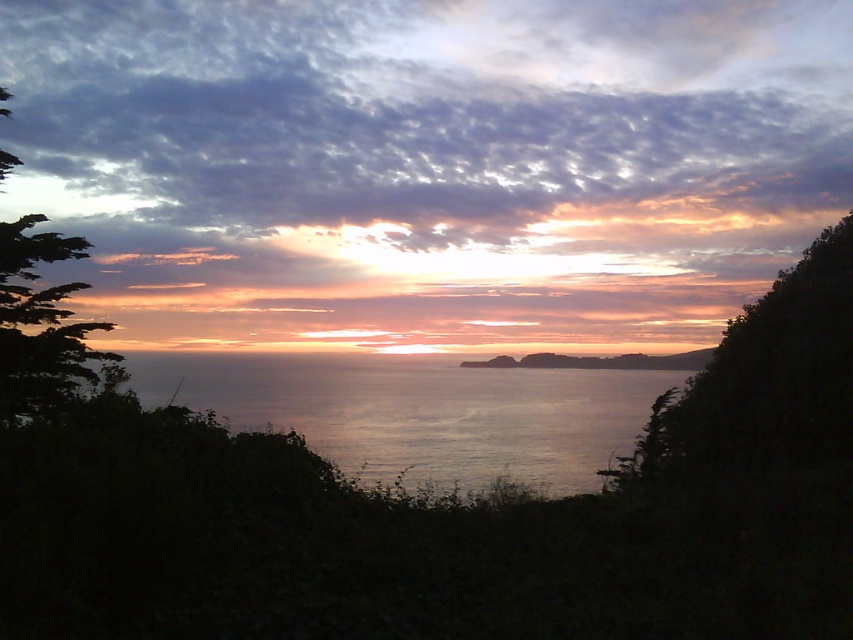
Question: Can you confirm if cloudy sky at upper center is positioned to the right of green leafy tree at left?

Choices:
 (A) yes
 (B) no

Answer: (A)

Question: Which of the following is the closest to the observer?

Choices:
 (A) (61, 369)
 (B) (607, 419)
 (C) (64, 115)

Answer: (A)

Question: Does silvery water at center have a larger size compared to green leafy tree at left?

Choices:
 (A) yes
 (B) no

Answer: (A)

Question: Observing the image, what is the correct spatial positioning of silvery water at center in reference to green leafy tree at left?

Choices:
 (A) above
 (B) below

Answer: (B)

Question: Which of the following is the farthest from the observer?

Choices:
 (A) (149, 100)
 (B) (526, 472)

Answer: (A)

Question: Which object is the closest to the silvery water at center?

Choices:
 (A) cloudy sky at upper center
 (B) green leafy tree at left

Answer: (A)